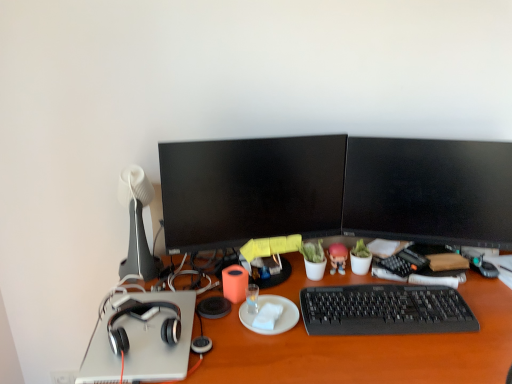
Where is `vacant space in front of black matte keyboard at lower right`? The width and height of the screenshot is (512, 384). vacant space in front of black matte keyboard at lower right is located at coordinates (404, 358).